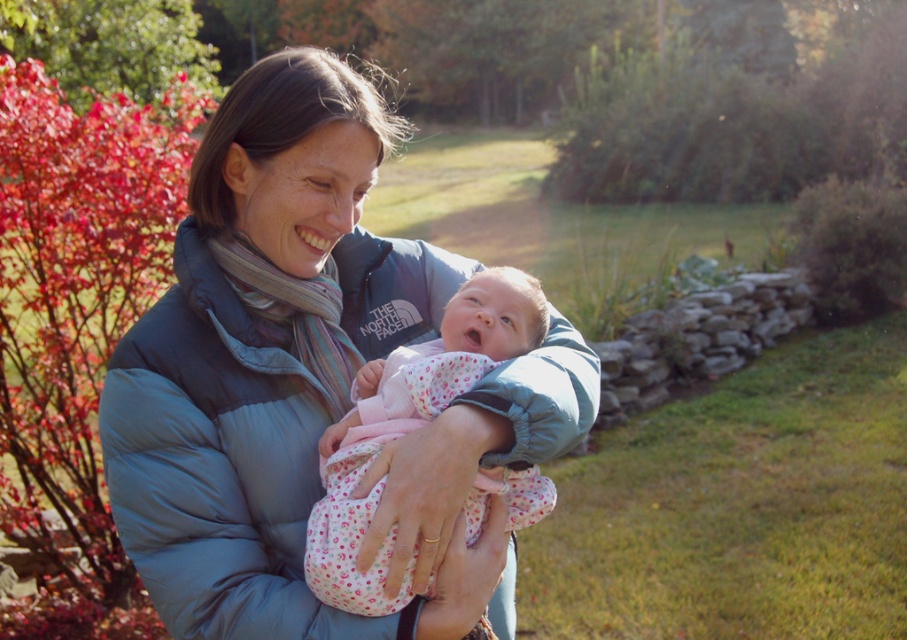
You are a photographer setting up a shot of the scene described. You want to ensure that both the matte blue down jacket at center and the floral fabric baby at center are visible in the frame. Given their sizes, which object should you position closer to the camera to maintain their visibility without cropping?

The matte blue down jacket at center is taller than the floral fabric baby at center. To ensure both are fully visible without cropping, position the floral fabric baby at center closer to the camera so its smaller size can be captured in full while the jacket remains in frame.

You are a photographer trying to capture a candid shot of the baby in the floral fabric baby at center without making the woman in the matte blue down jacket at center aware. Since the baby is behind the jacket, can you still get a clear photo of the baby?

The floral fabric baby at center is behind the matte blue down jacket at center, so the baby might be partially or fully obscured by the jacket, making it difficult to capture a clear photo without adjusting the position.